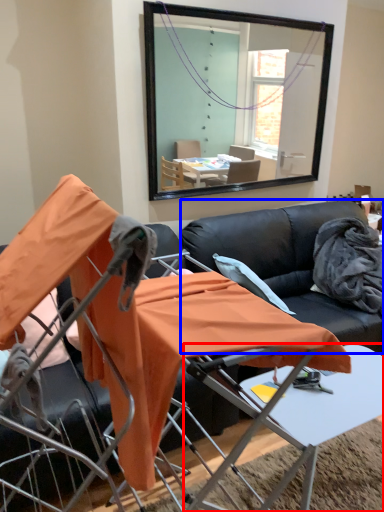
Question: Which object appears closest to the camera in this image, table (highlighted by a red box) or couch (highlighted by a blue box)?

Choices:
 (A) table
 (B) couch

Answer: (A)